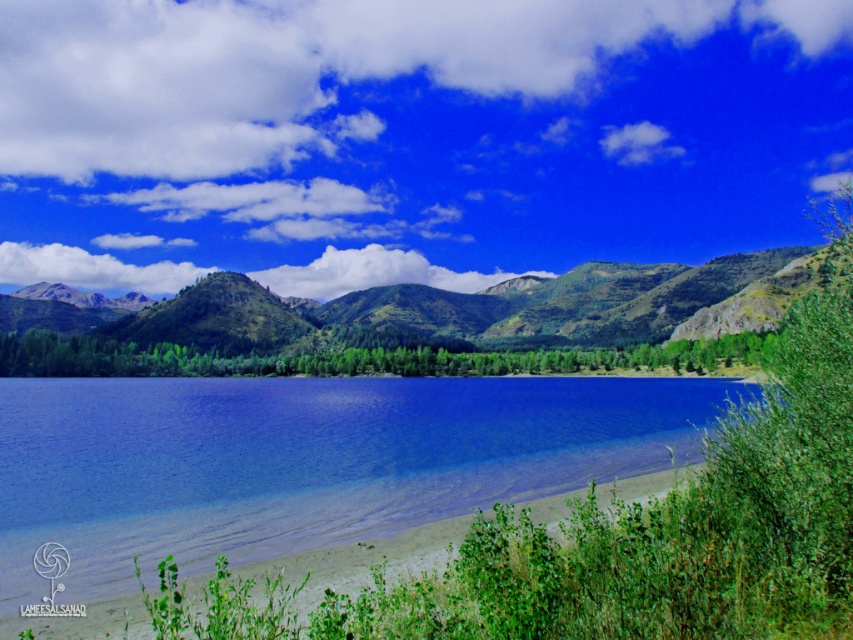
Who is more forward, (183, 484) or (486, 314)?

Point (183, 484) is in front.

Where is `blue glassy water at center`? blue glassy water at center is located at coordinates (303, 460).

Identify the location of blue glassy water at center. The height and width of the screenshot is (640, 853). (303, 460).

Is blue glassy water at center smaller than white fluffy cloud at center?

Yes, blue glassy water at center is smaller than white fluffy cloud at center.

Which is above, blue glassy water at center or white fluffy cloud at center?

white fluffy cloud at center

Does point (276, 416) come behind point (438, 268)?

No, (276, 416) is in front of (438, 268).

This screenshot has height=640, width=853. I want to click on blue glassy water at center, so click(303, 460).

Can you confirm if green grassy hill at center is positioned below white fluffy cloud at center?

Indeed, green grassy hill at center is positioned under white fluffy cloud at center.

Does green grassy hill at center come in front of white fluffy cloud at center?

Yes, green grassy hill at center is closer to the viewer.

Is point (679, 291) positioned before point (294, 268)?

Yes, point (679, 291) is closer to viewer.

I want to click on green grassy hill at center, so click(463, 308).